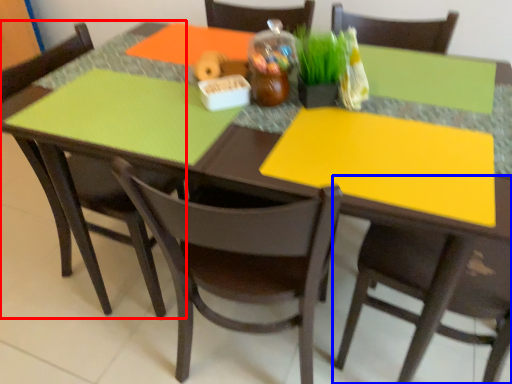
Question: Among these objects, which one is farthest to the camera, chair (highlighted by a red box) or chair (highlighted by a blue box)?

Choices:
 (A) chair
 (B) chair

Answer: (A)